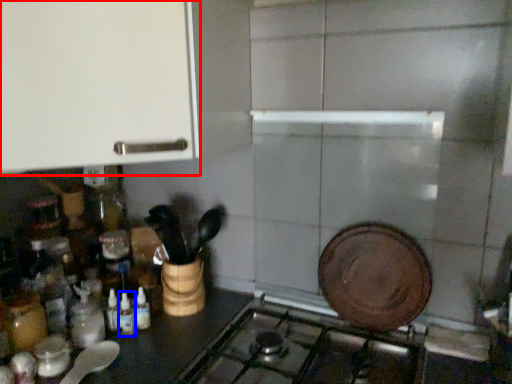
Question: Which of the following is the farthest to the observer, cabinetry (highlighted by a red box) or bottle (highlighted by a blue box)?

Choices:
 (A) cabinetry
 (B) bottle

Answer: (B)